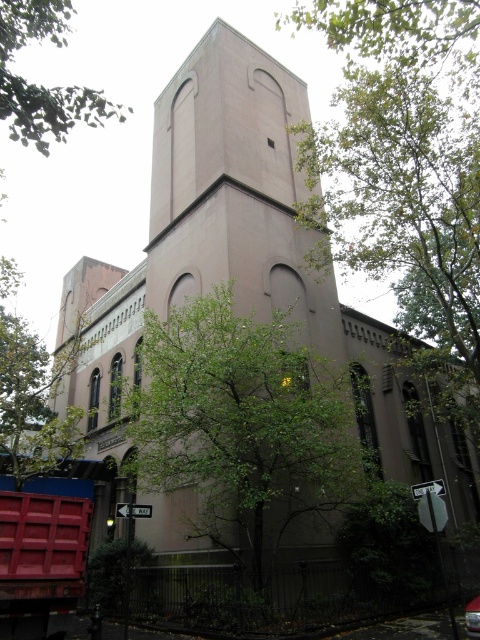
You are standing at the base of the building and looking towards the tower. There are two points marked on the building facade. The first point is at coordinate point (271, 460) and the second is at point (72, 100). Which of these points is closer to you?

Point (72, 100) is closer to you because it is in front of point (271, 460).

You are standing in front of the building and want to walk towards the green leafy tree at center. Which direction should you move relative to the green leafy tree at upper left?

Since the green leafy tree at center is closer to you than the green leafy tree at upper left, you should move towards the center of the building, away from the green leafy tree at upper left.